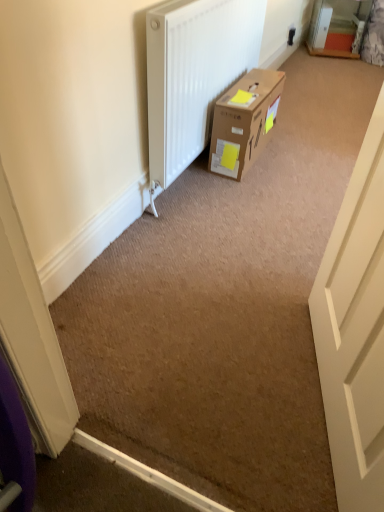
What are the coordinates of `free space in front of brown cardboard box at center` in the screenshot? It's located at (251, 190).